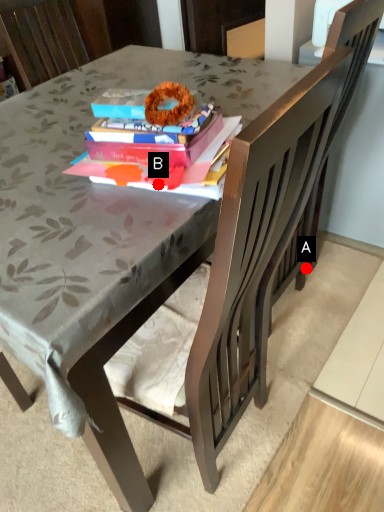
Question: Two points are circled on the image, labeled by A and B beside each circle. Which point is farther to the camera?

Choices:
 (A) A is further
 (B) B is further

Answer: (A)